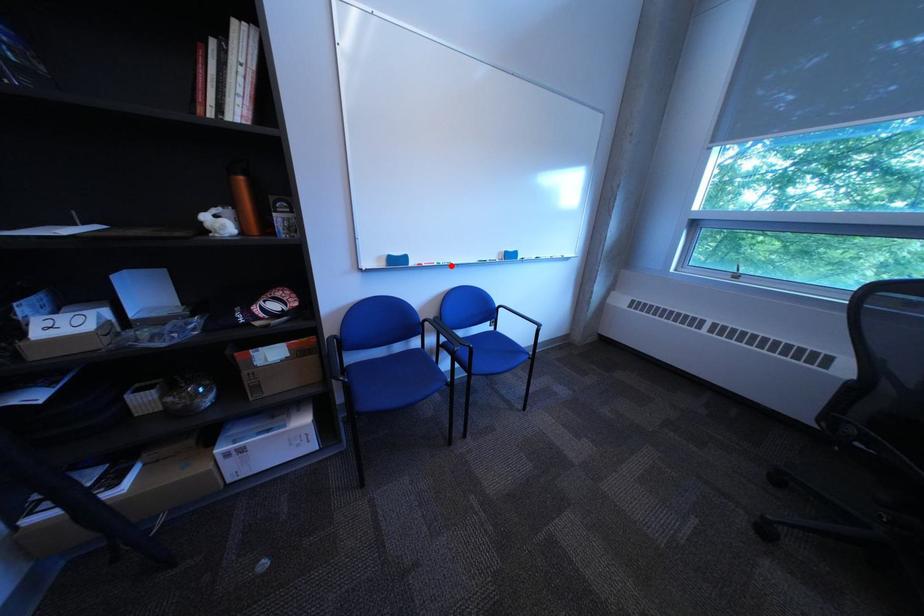
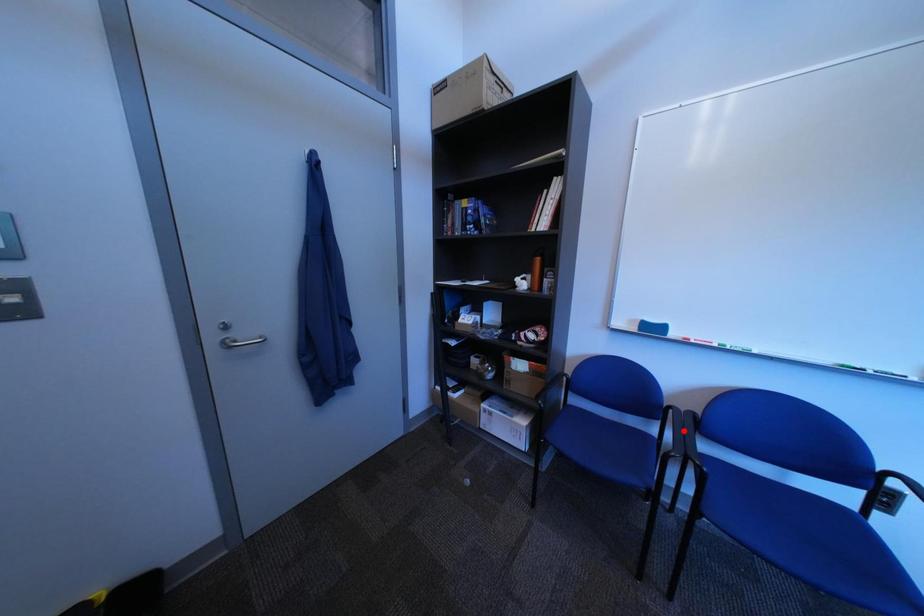
I am providing you with two images of the same scene from different viewpoints. A red point is marked on the first image and another point is marked on the second image. Does the point marked in image1 correspond to the same location as the one in image2?

No